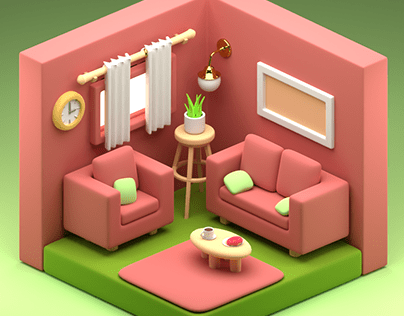
Locate an element on the screen. The height and width of the screenshot is (316, 404). coffee table is located at coordinates (214, 251).